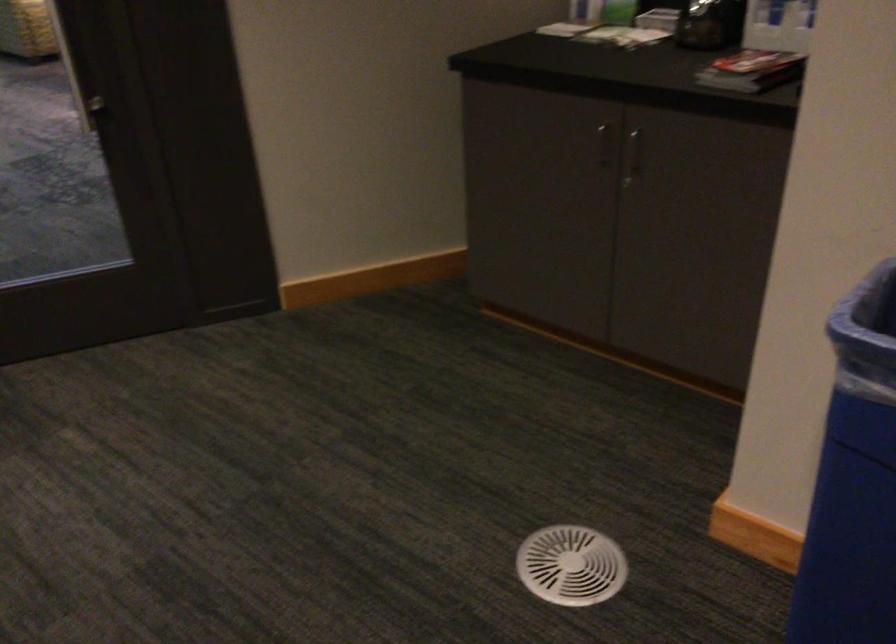
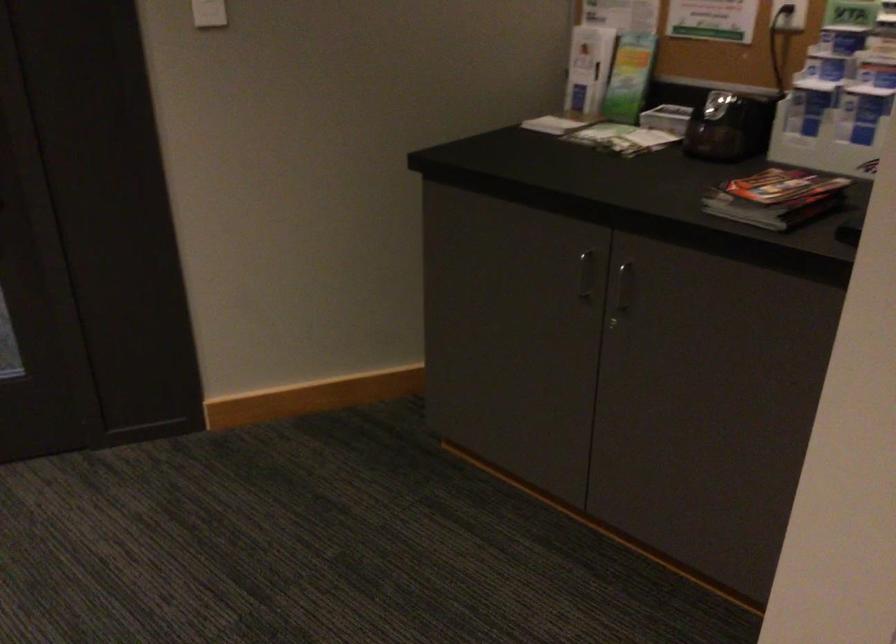
Locate, in the second image, the point that corresponds to [633,154] in the first image.

(622, 292)